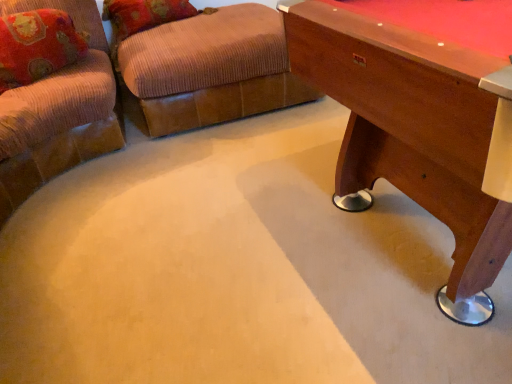
Question: Considering the relative sizes of wooden pool table at right and brown corduroy ottoman at upper center in the image provided, is wooden pool table at right thinner than brown corduroy ottoman at upper center?

Choices:
 (A) yes
 (B) no

Answer: (A)

Question: From the image's perspective, is wooden pool table at right on top of brown corduroy ottoman at upper center?

Choices:
 (A) no
 (B) yes

Answer: (A)

Question: Considering the relative positions of wooden pool table at right and brown corduroy ottoman at upper center in the image provided, is wooden pool table at right to the left of brown corduroy ottoman at upper center from the viewer's perspective?

Choices:
 (A) yes
 (B) no

Answer: (B)

Question: From a real-world perspective, is wooden pool table at right located beneath brown corduroy ottoman at upper center?

Choices:
 (A) yes
 (B) no

Answer: (B)

Question: Is brown corduroy ottoman at upper center at the back of wooden pool table at right?

Choices:
 (A) yes
 (B) no

Answer: (B)

Question: Is wooden pool table at right wider than brown corduroy ottoman at upper center?

Choices:
 (A) yes
 (B) no

Answer: (B)

Question: Is wooden pool table at right not near velvet floral pillow at upper left?

Choices:
 (A) no
 (B) yes

Answer: (B)

Question: From a real-world perspective, is wooden pool table at right on top of velvet floral pillow at upper left?

Choices:
 (A) yes
 (B) no

Answer: (B)

Question: Can you confirm if wooden pool table at right is wider than velvet floral pillow at upper left?

Choices:
 (A) no
 (B) yes

Answer: (B)

Question: Is wooden pool table at right with velvet floral pillow at upper left?

Choices:
 (A) yes
 (B) no

Answer: (B)

Question: Can you confirm if wooden pool table at right is smaller than velvet floral pillow at upper left?

Choices:
 (A) yes
 (B) no

Answer: (B)

Question: Is wooden pool table at right shorter than velvet floral pillow at upper left?

Choices:
 (A) yes
 (B) no

Answer: (B)

Question: Would you say brown corduroy ottoman at upper center is outside wooden pool table at right?

Choices:
 (A) no
 (B) yes

Answer: (B)